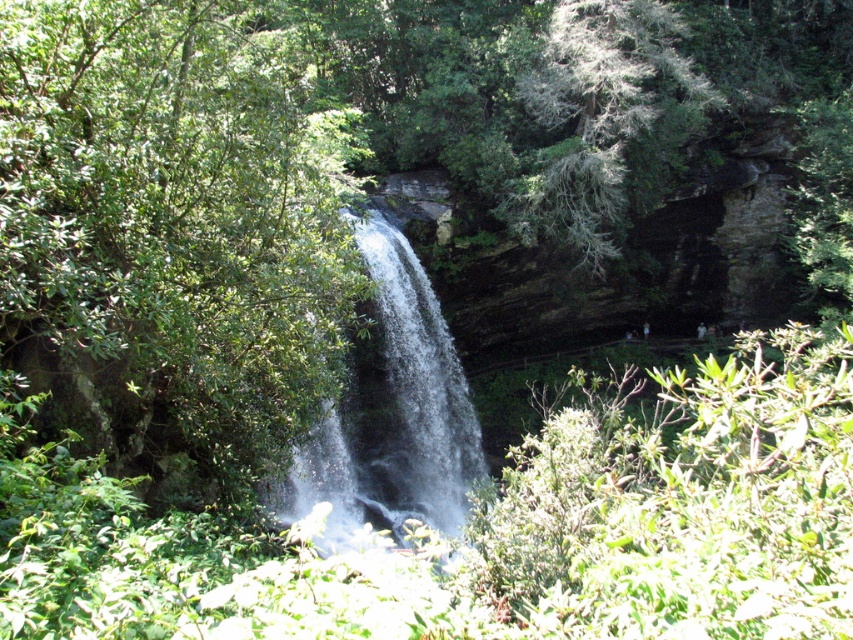
In the scene shown: Can you confirm if green leafy tree at center is taller than green textured rock at upper center?

Indeed, green leafy tree at center has a greater height compared to green textured rock at upper center.

Which of these two, green leafy tree at center or green textured rock at upper center, stands shorter?

green textured rock at upper center

The width and height of the screenshot is (853, 640). What do you see at coordinates (170, 236) in the screenshot?
I see `green leafy tree at center` at bounding box center [170, 236].

Identify the location of green leafy tree at center. (170, 236).

Describe the element at coordinates (393, 413) in the screenshot. I see `clear water at center` at that location.

Between clear water at center and green textured rock at upper center, which one is positioned lower?

clear water at center is lower down.

At what (x,y) coordinates should I click in order to perform the action: click on clear water at center. Please return your answer as a coordinate pair (x, y). The height and width of the screenshot is (640, 853). Looking at the image, I should click on (393, 413).

Which is more to the right, green leafy tree at center or clear water at center?

clear water at center is more to the right.

Does green leafy tree at center have a lesser width compared to clear water at center?

Correct, green leafy tree at center's width is less than clear water at center's.

Who is more forward, (300, 400) or (433, 451)?

Positioned in front is point (300, 400).

This screenshot has height=640, width=853. I want to click on green leafy tree at center, so click(x=170, y=236).